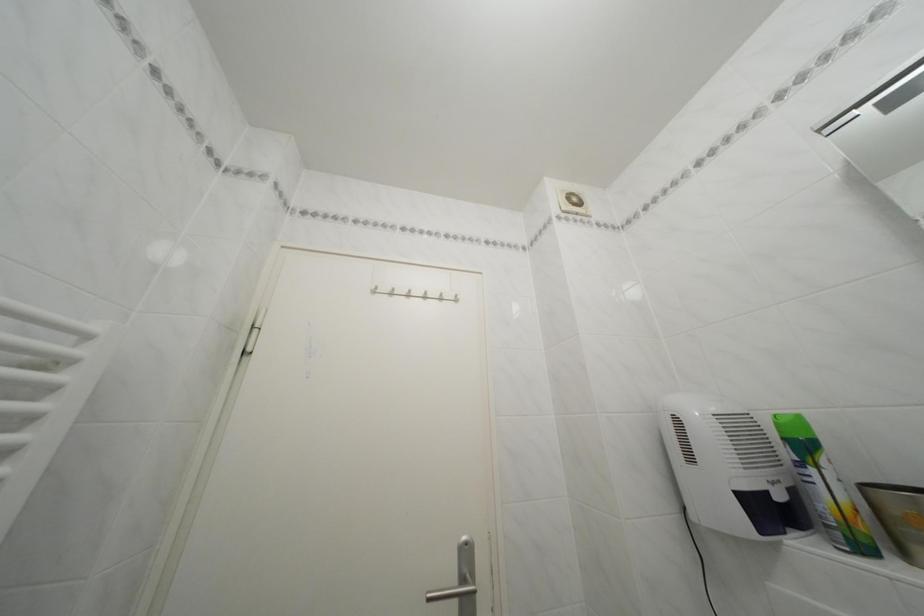
Identify the location of gold cup. The image size is (924, 616). (898, 516).